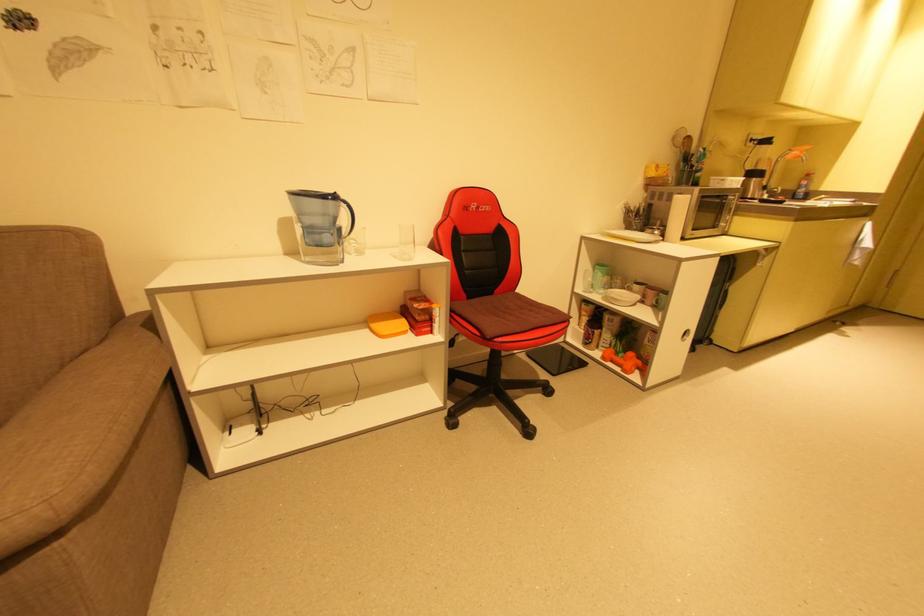
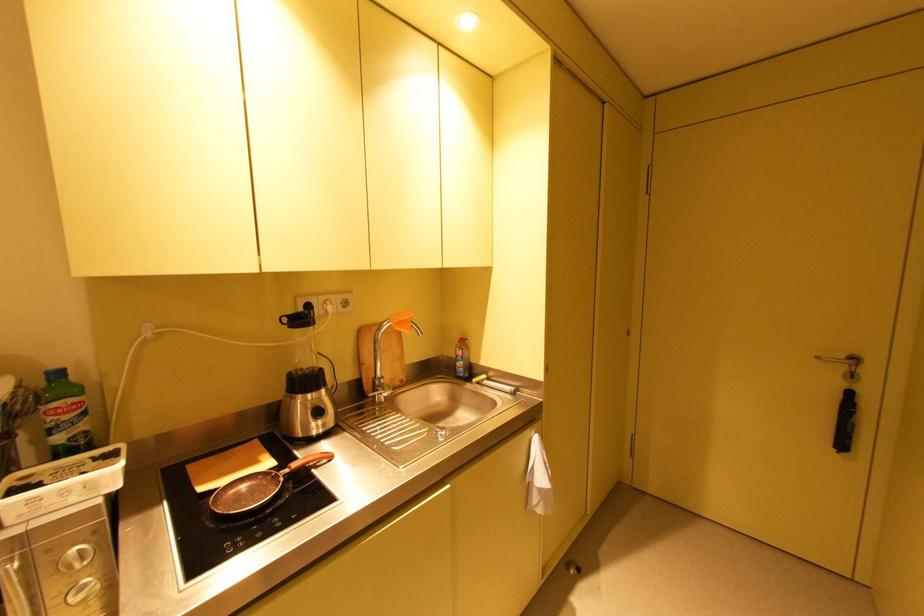
What movement of the cameraman would produce the second image?

The cameraman moved toward right, forward.